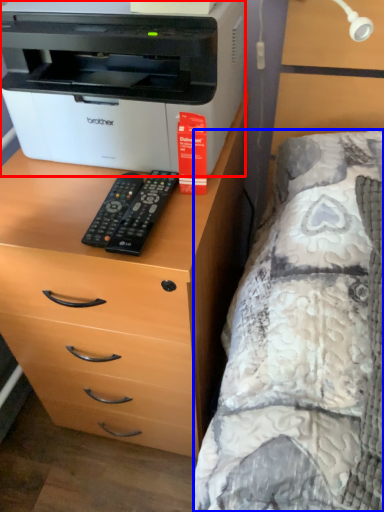
Question: Which of the following is the closest to the observer, printer (highlighted by a red box) or bed (highlighted by a blue box)?

Choices:
 (A) printer
 (B) bed

Answer: (B)